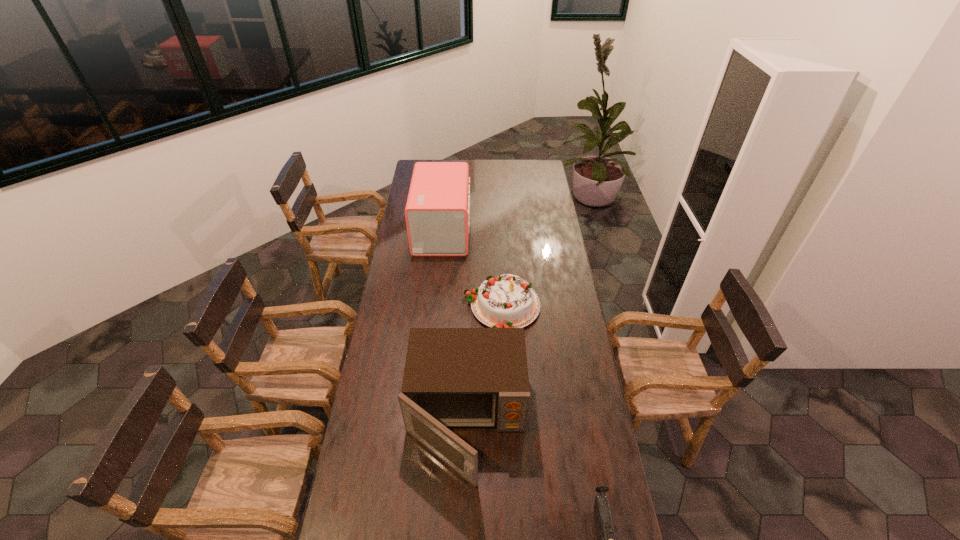
Identify the location of box. The image size is (960, 540). (437, 213).

Identify the location of the farthest object. (437, 213).

Locate an element on the screen. This screenshot has width=960, height=540. microwave oven is located at coordinates (453, 377).

At what (x,y) coordinates should I click in order to perform the action: click on the third farthest object. Please return your answer as a coordinate pair (x, y). The width and height of the screenshot is (960, 540). Looking at the image, I should click on (453, 377).

The image size is (960, 540). Identify the location of the second shortest object. (507, 301).

This screenshot has height=540, width=960. I want to click on the third nearest object, so click(507, 301).

You are a GUI agent. You are given a task and a screenshot of the screen. Output one action in this format:
    pyautogui.click(x=<x>, y=<y>)
    Task: Click on the vacant position located on the surface of the box where the text is embossed
    
    Given the screenshot: What is the action you would take?
    pyautogui.click(x=479, y=230)

What are the coordinates of `vacant space situated with the door open on the front of the microwave oven` in the screenshot? It's located at (464, 526).

Locate an element on the screen. This screenshot has width=960, height=540. vacant space located on the front of the second farthest object is located at coordinates (507, 424).

The image size is (960, 540). Find the location of `object that is at the left edge`. object that is at the left edge is located at coordinates (437, 213).